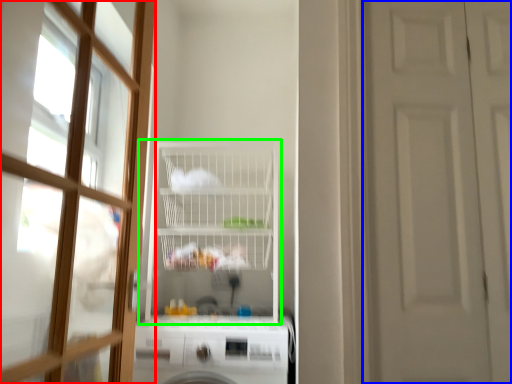
Question: Which object is the farthest from door (highlighted by a red box)? Choose among these: door (highlighted by a blue box) or shelf (highlighted by a green box).

Choices:
 (A) door
 (B) shelf

Answer: (A)